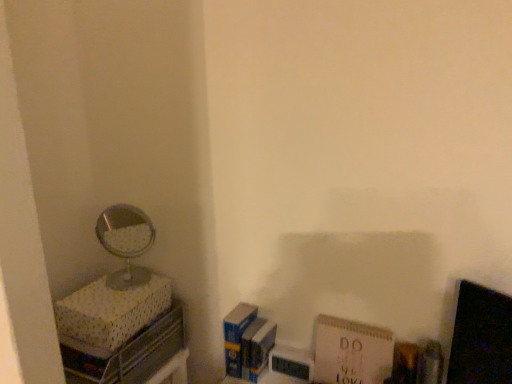
Question: Is shiny silver mirror at left located within white paper at lower right, which is the first paperback book in right-to-left order?

Choices:
 (A) yes
 (B) no

Answer: (B)

Question: Does white paper at lower right, marked as the second paperback book in a left-to-right arrangement, turn towards shiny silver mirror at left?

Choices:
 (A) yes
 (B) no

Answer: (B)

Question: Is white paper at lower right, marked as the second paperback book in a left-to-right arrangement, positioned beyond the bounds of shiny silver mirror at left?

Choices:
 (A) yes
 (B) no

Answer: (A)

Question: Is shiny silver mirror at left at the back of white paper at lower right, which is the first paperback book in right-to-left order?

Choices:
 (A) no
 (B) yes

Answer: (A)

Question: Is white paper at lower right, which is the first paperback book in right-to-left order, taller than shiny silver mirror at left?

Choices:
 (A) yes
 (B) no

Answer: (B)

Question: Could you tell me if shiny silver mirror at left is facing blue matte paperback book at lower center, arranged as the 2th paperback book when viewed from the right?

Choices:
 (A) no
 (B) yes

Answer: (A)

Question: Can you confirm if shiny silver mirror at left is wider than blue matte paperback book at lower center, arranged as the 2th paperback book when viewed from the right?

Choices:
 (A) no
 (B) yes

Answer: (B)

Question: From the image's perspective, does shiny silver mirror at left appear lower than blue matte paperback book at lower center, arranged as the 2th paperback book when viewed from the right?

Choices:
 (A) yes
 (B) no

Answer: (B)

Question: Is shiny silver mirror at left next to blue matte paperback book at lower center, arranged as the 2th paperback book when viewed from the right, and touching it?

Choices:
 (A) no
 (B) yes

Answer: (A)

Question: Is shiny silver mirror at left smaller than blue matte paperback book at lower center, which is the 1th paperback book in left-to-right order?

Choices:
 (A) yes
 (B) no

Answer: (B)

Question: Is the position of shiny silver mirror at left more distant than that of blue matte paperback book at lower center, which is the 1th paperback book in left-to-right order?

Choices:
 (A) yes
 (B) no

Answer: (B)

Question: Is the position of blue matte paperback book at lower center, which is the 1th paperback book in left-to-right order, less distant than that of shiny silver mirror at left?

Choices:
 (A) yes
 (B) no

Answer: (B)